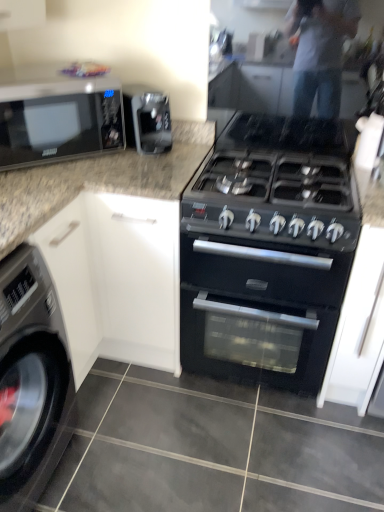
Question: Considering the relative sizes of black matte oven at center and black glossy microwave at upper left in the image provided, is black matte oven at center shorter than black glossy microwave at upper left?

Choices:
 (A) yes
 (B) no

Answer: (B)

Question: Does black matte oven at center appear on the right side of black glossy microwave at upper left?

Choices:
 (A) no
 (B) yes

Answer: (B)

Question: Can you confirm if black matte oven at center is bigger than black glossy microwave at upper left?

Choices:
 (A) yes
 (B) no

Answer: (A)

Question: From a real-world perspective, is black matte oven at center physically above black glossy microwave at upper left?

Choices:
 (A) yes
 (B) no

Answer: (B)

Question: Does black matte oven at center have a greater width compared to black glossy microwave at upper left?

Choices:
 (A) yes
 (B) no

Answer: (A)

Question: Is black matte oven at center facing towards black glossy microwave at upper left?

Choices:
 (A) yes
 (B) no

Answer: (B)

Question: Would you say satin black coffee machine at upper center is outside metallic gray washing machine at lower left?

Choices:
 (A) no
 (B) yes

Answer: (B)

Question: Is satin black coffee machine at upper center aimed at metallic gray washing machine at lower left?

Choices:
 (A) no
 (B) yes

Answer: (A)

Question: Does satin black coffee machine at upper center appear on the right side of metallic gray washing machine at lower left?

Choices:
 (A) yes
 (B) no

Answer: (A)

Question: Can you confirm if satin black coffee machine at upper center is taller than metallic gray washing machine at lower left?

Choices:
 (A) yes
 (B) no

Answer: (B)

Question: Considering the relative sizes of satin black coffee machine at upper center and metallic gray washing machine at lower left in the image provided, is satin black coffee machine at upper center bigger than metallic gray washing machine at lower left?

Choices:
 (A) yes
 (B) no

Answer: (B)

Question: Is satin black coffee machine at upper center next to metallic gray washing machine at lower left and touching it?

Choices:
 (A) no
 (B) yes

Answer: (A)

Question: Does black glossy microwave at upper left have a greater height compared to satin black coffee machine at upper center?

Choices:
 (A) yes
 (B) no

Answer: (A)